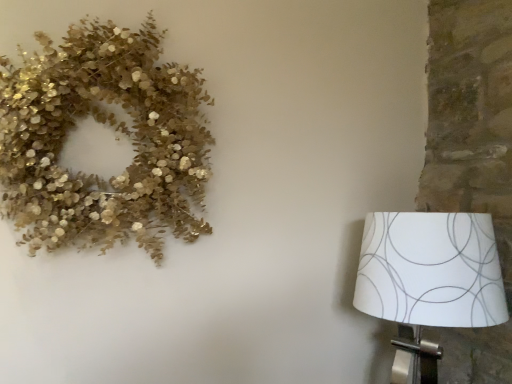
Question: Is gold glittery wreath at upper left wider than white paper lampshade at right?

Choices:
 (A) yes
 (B) no

Answer: (B)

Question: From the image's perspective, would you say gold glittery wreath at upper left is shown under white paper lampshade at right?

Choices:
 (A) no
 (B) yes

Answer: (A)

Question: Can white paper lampshade at right be found inside gold glittery wreath at upper left?

Choices:
 (A) no
 (B) yes

Answer: (A)

Question: Is gold glittery wreath at upper left bigger than white paper lampshade at right?

Choices:
 (A) yes
 (B) no

Answer: (B)

Question: Are gold glittery wreath at upper left and white paper lampshade at right located far from each other?

Choices:
 (A) no
 (B) yes

Answer: (A)

Question: Is the surface of gold glittery wreath at upper left in direct contact with white paper lampshade at right?

Choices:
 (A) yes
 (B) no

Answer: (B)

Question: Is white paper lampshade at right positioned beyond the bounds of gold glittery wreath at upper left?

Choices:
 (A) no
 (B) yes

Answer: (B)

Question: From a real-world perspective, is white paper lampshade at right located higher than gold glittery wreath at upper left?

Choices:
 (A) yes
 (B) no

Answer: (B)

Question: Can you see white paper lampshade at right touching gold glittery wreath at upper left?

Choices:
 (A) no
 (B) yes

Answer: (A)

Question: From the image's perspective, is white paper lampshade at right below gold glittery wreath at upper left?

Choices:
 (A) yes
 (B) no

Answer: (A)

Question: Does white paper lampshade at right have a larger size compared to gold glittery wreath at upper left?

Choices:
 (A) no
 (B) yes

Answer: (B)

Question: Does white paper lampshade at right have a smaller size compared to gold glittery wreath at upper left?

Choices:
 (A) no
 (B) yes

Answer: (A)

Question: Considering the positions of gold glittery wreath at upper left and white paper lampshade at right in the image, is gold glittery wreath at upper left wider or thinner than white paper lampshade at right?

Choices:
 (A) thin
 (B) wide

Answer: (A)